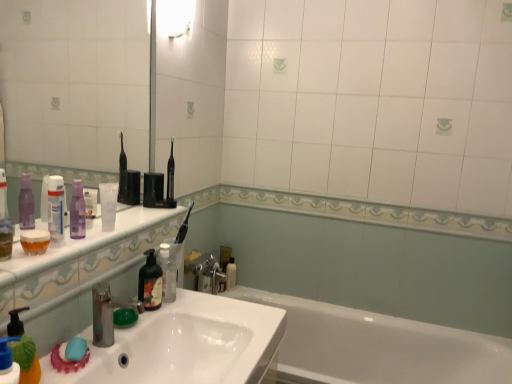
Question: From the image's perspective, does white glossy sink at lower left appear lower than white glossy bottle at lower center, which appears as the fourth toiletry when viewed from the left?

Choices:
 (A) yes
 (B) no

Answer: (A)

Question: Is white glossy sink at lower left located outside white glossy bottle at lower center, the first toiletry positioned from the bottom?

Choices:
 (A) yes
 (B) no

Answer: (A)

Question: From a real-world perspective, is white glossy sink at lower left positioned over white glossy bottle at lower center, which appears as the fourth toiletry when viewed from the left, based on gravity?

Choices:
 (A) no
 (B) yes

Answer: (B)

Question: Considering the relative sizes of white glossy sink at lower left and white glossy bottle at lower center, the fourth toiletry from the top, in the image provided, is white glossy sink at lower left smaller than white glossy bottle at lower center, the fourth toiletry from the top,?

Choices:
 (A) no
 (B) yes

Answer: (A)

Question: Does white glossy sink at lower left have a lesser width compared to white glossy bottle at lower center, which ranks as the first toiletry in right-to-left order?

Choices:
 (A) no
 (B) yes

Answer: (A)

Question: Is white glossy sink at lower left wider than white glossy bottle at lower center, which is counted as the 4th toiletry, starting from the front?

Choices:
 (A) yes
 (B) no

Answer: (A)

Question: Is white glossy sink at lower left directly adjacent to white glossy tube at upper left, which is counted as the first toiletry, starting from the front?

Choices:
 (A) yes
 (B) no

Answer: (B)

Question: From the image's perspective, is white glossy sink at lower left under white glossy tube at upper left, marked as the 3th toiletry in a bottom-to-top arrangement?

Choices:
 (A) yes
 (B) no

Answer: (A)

Question: From the image's perspective, would you say white glossy sink at lower left is positioned over white glossy tube at upper left, marked as the 3th toiletry in a bottom-to-top arrangement?

Choices:
 (A) yes
 (B) no

Answer: (B)

Question: Is white glossy sink at lower left oriented towards white glossy tube at upper left, which is counted as the first toiletry, starting from the front?

Choices:
 (A) yes
 (B) no

Answer: (B)

Question: Is white glossy sink at lower left smaller than white glossy tube at upper left, marked as the 3th toiletry in a bottom-to-top arrangement?

Choices:
 (A) no
 (B) yes

Answer: (A)

Question: Can you confirm if white glossy sink at lower left is taller than white glossy tube at upper left, which is counted as the first toiletry, starting from the front?

Choices:
 (A) yes
 (B) no

Answer: (B)

Question: From a real-world perspective, is purple matte bottle at left, placed as the second toiletry when sorted from front to back, positioned over purple matte lotion at upper left, acting as the second toiletry starting from the back, based on gravity?

Choices:
 (A) yes
 (B) no

Answer: (A)